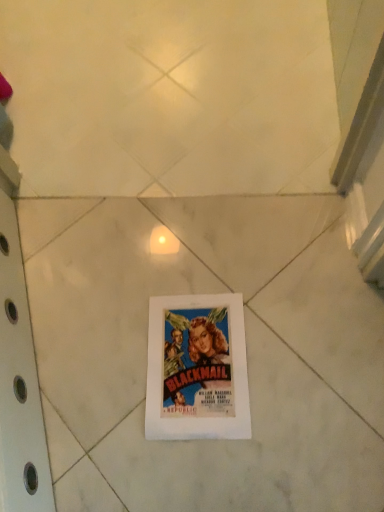
At what (x,y) coordinates should I click in order to perform the action: click on white paper at center. Please return your answer as a coordinate pair (x, y). Looking at the image, I should click on (197, 368).

The image size is (384, 512). Describe the element at coordinates (197, 368) in the screenshot. I see `white paper at center` at that location.

At what (x,y) coordinates should I click in order to perform the action: click on white paper at center. Please return your answer as a coordinate pair (x, y). Looking at the image, I should click on (247, 352).

Image resolution: width=384 pixels, height=512 pixels. What do you see at coordinates (247, 352) in the screenshot?
I see `white paper at center` at bounding box center [247, 352].

Identify the location of white paper at center. Image resolution: width=384 pixels, height=512 pixels. (197, 368).

Is white paper at center to the left or to the right of white paper at center in the image?

In the image, white paper at center appears on the left side of white paper at center.

Relative to white paper at center, is white paper at center in front or behind?

Visually, white paper at center is located in front of white paper at center.

Is point (266, 229) positioned behind point (230, 434)?

Yes, it is.

From the image's perspective, between white paper at center and white paper at center, which one is located above?

white paper at center.

In the scene shown: From a real-world perspective, is white paper at center physically below white paper at center?

Yes, from a real-world perspective, white paper at center is under white paper at center.

Considering the relative sizes of white paper at center and white paper at center in the image provided, is white paper at center wider than white paper at center?

Yes.

Considering the sizes of objects white paper at center and white paper at center in the image provided, who is taller, white paper at center or white paper at center?

Standing taller between the two is white paper at center.

Based on their sizes in the image, would you say white paper at center is bigger or smaller than white paper at center?

Clearly, white paper at center is larger in size than white paper at center.

Could white paper at center be considered to be inside white paper at center?

Yes, white paper at center contains white paper at center.

Is white paper at center positioned far away from white paper at center?

white paper at center is near white paper at center, not far away.

Is white paper at center at the back of white paper at center?

No, white paper at center is not facing the opposite direction of white paper at center.

How different are the orientations of white paper at center and white paper at center in degrees?

white paper at center and white paper at center are facing 3.12 degrees away from each other.

How distant is white paper at center from white paper at center?

white paper at center is 4.30 inches from white paper at center.

The image size is (384, 512). Identify the location of tile located on the left of white paper at center. (247, 352).

Which object is positioned more to the left, white paper at center or white paper at center?

From the viewer's perspective, white paper at center appears more on the left side.

Considering the relative positions of white paper at center and white paper at center in the image provided, is white paper at center in front of white paper at center?

No, the depth of white paper at center is greater than that of white paper at center.

Does point (166, 417) come behind point (305, 320)?

No, it is not.

From the image's perspective, between white paper at center and white paper at center, who is located below?

From the image's view, white paper at center is below.

From a real-world perspective, which object rests below the other?

white paper at center, from a real-world perspective.

Considering the sizes of objects white paper at center and white paper at center in the image provided, who is wider, white paper at center or white paper at center?

With larger width is white paper at center.

Considering the sizes of objects white paper at center and white paper at center in the image provided, who is taller, white paper at center or white paper at center?

With more height is white paper at center.

Is white paper at center smaller than white paper at center?

Yes.

Is white paper at center outside of white paper at center?

Actually, white paper at center is at least partially inside white paper at center.

Would you say white paper at center is a long distance from white paper at center?

A: white paper at center is actually quite close to white paper at center.

Could you tell me if white paper at center is turned towards white paper at center?

Yes, white paper at center is oriented towards white paper at center.

Can you tell me how much white paper at center and white paper at center differ in facing direction?

There is a 3.12-degree angle between the facing directions of white paper at center and white paper at center.

This screenshot has height=512, width=384. I want to click on picture frame lying below the white paper at center (from the image's perspective), so click(197, 368).

Where is `tile in front of the white paper at center`? The image size is (384, 512). tile in front of the white paper at center is located at coordinates (247, 352).

Find the location of `tile above the white paper at center (from the image's perspective)`. tile above the white paper at center (from the image's perspective) is located at coordinates (247, 352).